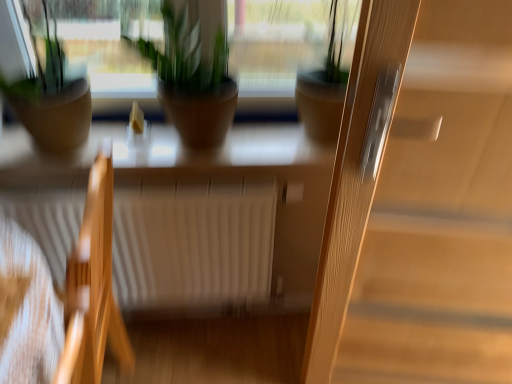
Question: Considering the positions of white matte radiator at center and matte brown pot at left, which is the first houseplant from left to right, in the image, is white matte radiator at center taller or shorter than matte brown pot at left, which is the first houseplant from left to right,?

Choices:
 (A) tall
 (B) short

Answer: (A)

Question: From the image's perspective, is white matte radiator at center positioned above or below matte brown pot at left, which is the first houseplant from left to right?

Choices:
 (A) above
 (B) below

Answer: (B)

Question: Estimate the real-world distances between objects in this image. Which object is closer to the light brown wood screen door at right?

Choices:
 (A) white matte radiator at center
 (B) wooden chair at left
 (C) green matte plant pot at center, the first houseplant from the right
 (D) matte brown pot at left, which is counted as the third houseplant, starting from the right
 (E) matte brown pot at center, which is counted as the second houseplant, starting from the right

Answer: (C)

Question: Based on their relative distances, which object is nearer to the matte brown pot at left, which is counted as the third houseplant, starting from the right?

Choices:
 (A) matte brown pot at center, acting as the 2th houseplant starting from the left
 (B) white matte radiator at center
 (C) green matte plant pot at center, the first houseplant from the right
 (D) light brown wood screen door at right
 (E) wooden chair at left

Answer: (A)